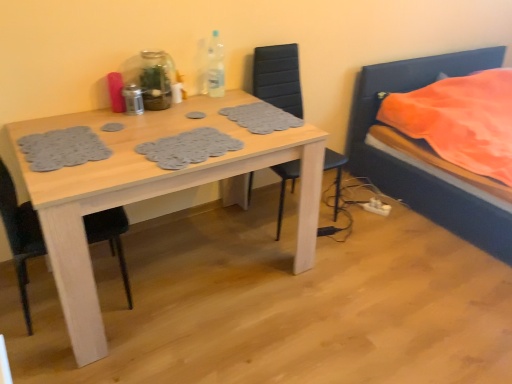
Locate an element on the screen. This screenshot has width=512, height=384. free space to the back side of white plastic power plugs and sockets at lower right is located at coordinates (367, 198).